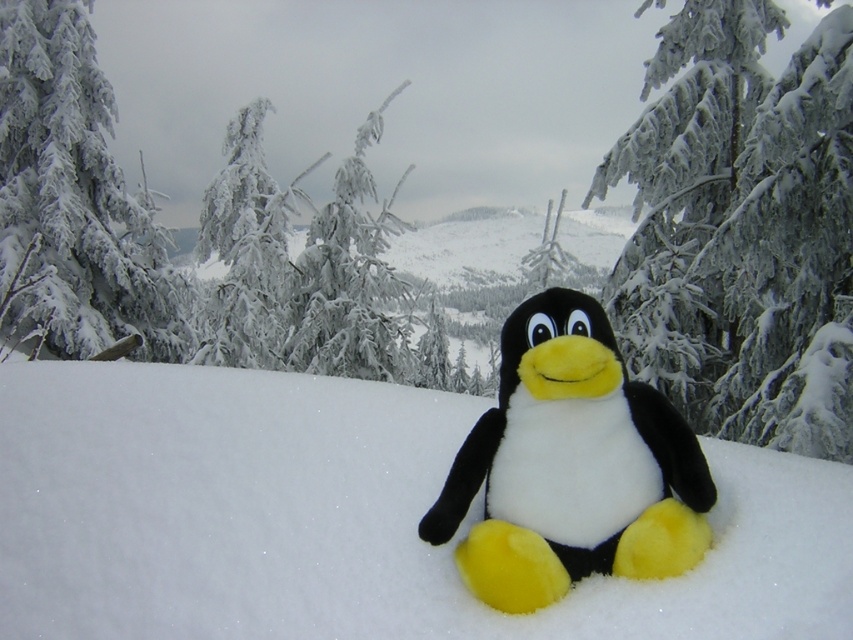
You are standing in the snowy landscape and want to place a small flag at one of the two points marked in the image. The flag needs to be placed closer to the viewer. Which point should you choose between point (97,221) and point (219,336)?

Point (97,221) is further to the viewer than point (219,336), so you should choose point (97,221) to place the flag closer to the viewer.